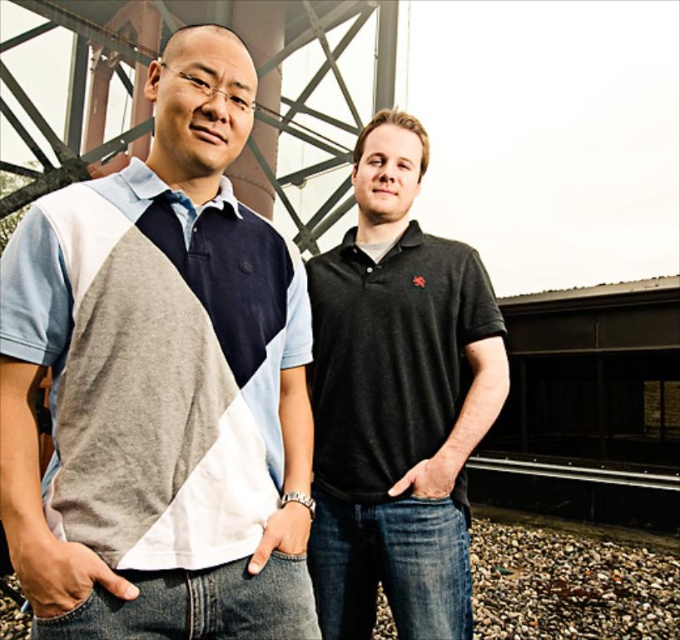
Between tri-color polo shirt at left and black matte polo shirt at center, which one is positioned higher?

tri-color polo shirt at left is higher up.

Who is positioned more to the left, tri-color polo shirt at left or black matte polo shirt at center?

From the viewer's perspective, tri-color polo shirt at left appears more on the left side.

This screenshot has height=640, width=680. What do you see at coordinates (160, 385) in the screenshot? I see `tri-color polo shirt at left` at bounding box center [160, 385].

Where is `tri-color polo shirt at left`? tri-color polo shirt at left is located at coordinates (160, 385).